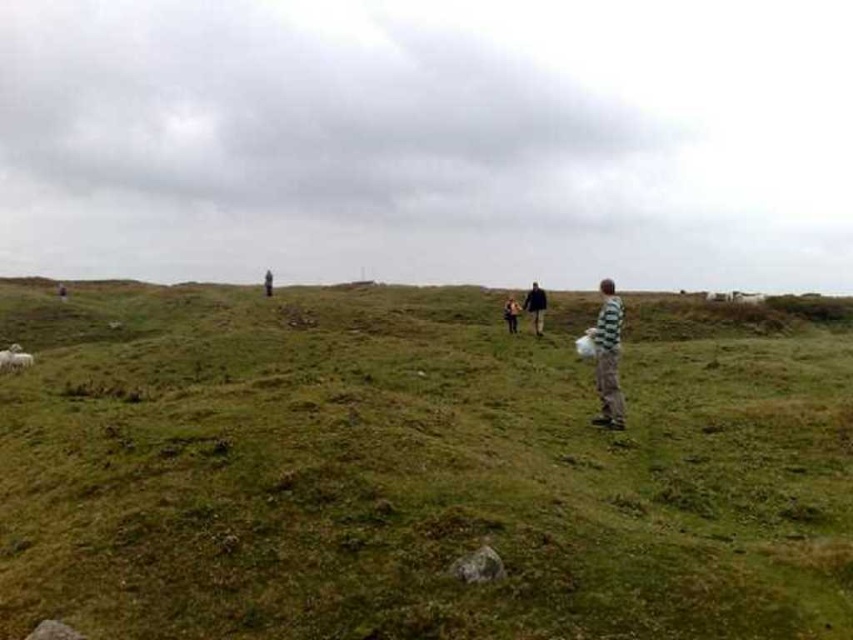
Question: Does green grassy field at center have a lesser width compared to dark brown leather jacket at center?

Choices:
 (A) yes
 (B) no

Answer: (B)

Question: Which point is closer to the camera?

Choices:
 (A) green grassy field at center
 (B) dark green jacket at center

Answer: (A)

Question: Which of the following is the farthest from the observer?

Choices:
 (A) striped fabric person at right
 (B) dark brown leather jacket at center

Answer: (B)

Question: Does green striped shirt at center appear on the right side of dark green jacket at center?

Choices:
 (A) no
 (B) yes

Answer: (B)

Question: Which of the following is the closest to the observer?

Choices:
 (A) dark brown leather jacket at center
 (B) dark green jacket at center
 (C) green striped shirt at center

Answer: (A)

Question: Considering the relative positions of striped fabric person at right and dark brown leather jacket at center in the image provided, where is striped fabric person at right located with respect to dark brown leather jacket at center?

Choices:
 (A) below
 (B) above

Answer: (A)